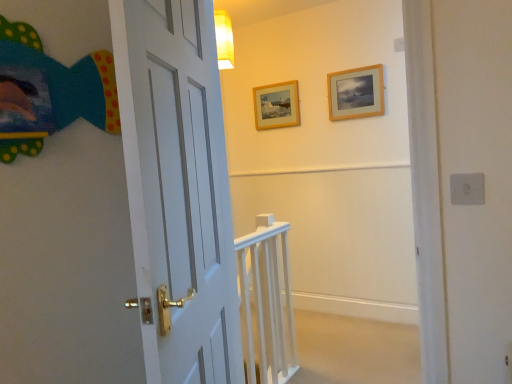
Question: Considering the positions of wooden picture frame at upper center, positioned as the second picture frame in back-to-front order, and wooden picture frame at upper center, positioned as the 2th picture frame in front-to-back order, in the image, is wooden picture frame at upper center, positioned as the second picture frame in back-to-front order, taller or shorter than wooden picture frame at upper center, positioned as the 2th picture frame in front-to-back order,?

Choices:
 (A) short
 (B) tall

Answer: (B)

Question: Would you say wooden picture frame at upper center, which is the 1th picture frame from right to left, is to the left or to the right of wooden picture frame at upper center, positioned as the 2th picture frame in front-to-back order, in the picture?

Choices:
 (A) right
 (B) left

Answer: (A)

Question: Which object is the closest to the white wooden rail at center?

Choices:
 (A) wooden picture frame at upper center, which is the 1th picture frame in left-to-right order
 (B) wooden picture frame at upper center, which is the 1th picture frame from right to left

Answer: (B)

Question: Which object is positioned closest to the white wooden rail at center?

Choices:
 (A) wooden picture frame at upper center, positioned as the second picture frame in back-to-front order
 (B) wooden picture frame at upper center, arranged as the first picture frame when viewed from the back

Answer: (A)